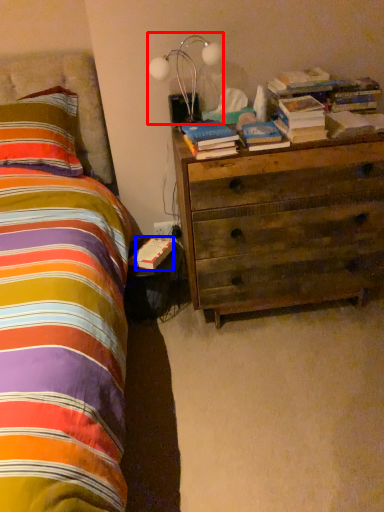
Question: Which point is closer to the camera, lamp (highlighted by a red box) or paperback book (highlighted by a blue box)?

Choices:
 (A) lamp
 (B) paperback book

Answer: (A)